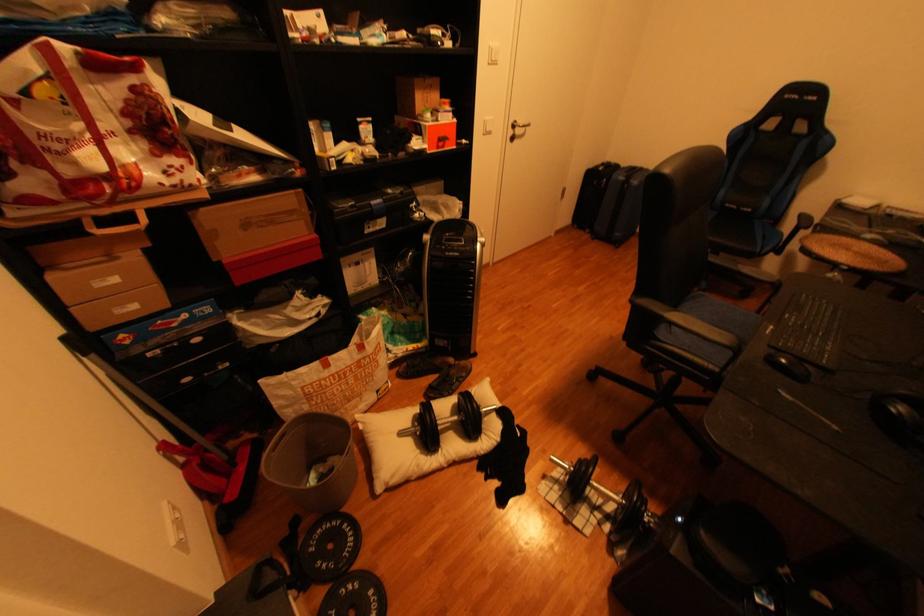
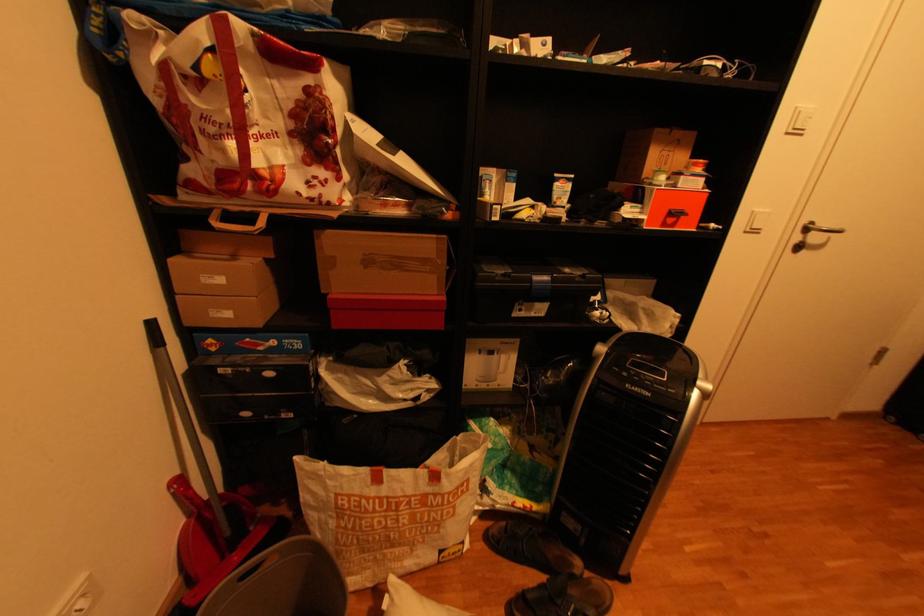
Locate, in the second image, the point that corresponds to [523,127] in the first image.

(816, 230)